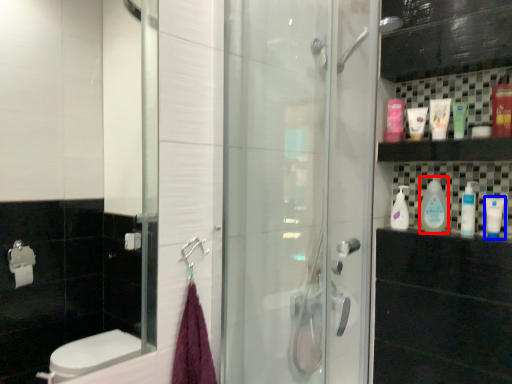
Question: Which object appears farthest to the camera in this image, cleaning product (highlighted by a red box) or mouthwash (highlighted by a blue box)?

Choices:
 (A) cleaning product
 (B) mouthwash

Answer: (A)